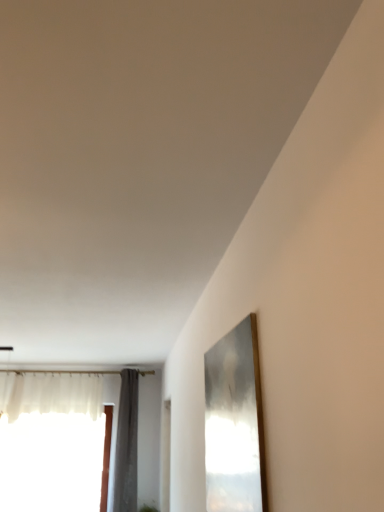
What is the approximate width of translucent fabric window at left?

translucent fabric window at left is 11.16 inches wide.

The image size is (384, 512). I want to click on translucent fabric window at left, so click(x=51, y=442).

The height and width of the screenshot is (512, 384). Describe the element at coordinates (51, 442) in the screenshot. I see `translucent fabric window at left` at that location.

Find the location of a particular element. gray fabric curtain at left is located at coordinates (126, 446).

Describe the element at coordinates (126, 446) in the screenshot. I see `gray fabric curtain at left` at that location.

At what (x,y) coordinates should I click in order to perform the action: click on translucent fabric window at left. Please return your answer as a coordinate pair (x, y). Looking at the image, I should click on (51, 442).

Is gray fabric curtain at left to the left of translucent fabric window at left from the viewer's perspective?

In fact, gray fabric curtain at left is to the right of translucent fabric window at left.

Which object is closer to the camera, gray fabric curtain at left or translucent fabric window at left?

Positioned in front is gray fabric curtain at left.

Which point is more distant from viewer, (135, 418) or (78, 386)?

Positioned behind is point (135, 418).

From the image's perspective, which is below, gray fabric curtain at left or translucent fabric window at left?

translucent fabric window at left appears lower in the image.

From a real-world perspective, is gray fabric curtain at left located higher than translucent fabric window at left?

Yes, from a real-world perspective, gray fabric curtain at left is over translucent fabric window at left

Which of these two, gray fabric curtain at left or translucent fabric window at left, is wider?

gray fabric curtain at left is wider.

Does gray fabric curtain at left have a lesser height compared to translucent fabric window at left?

No, gray fabric curtain at left is not shorter than translucent fabric window at left.

Does gray fabric curtain at left have a larger size compared to translucent fabric window at left?

Actually, gray fabric curtain at left might be smaller than translucent fabric window at left.

Is gray fabric curtain at left inside the boundaries of translucent fabric window at left, or outside?

gray fabric curtain at left lies outside translucent fabric window at left.

Is gray fabric curtain at left in contact with translucent fabric window at left?

No, gray fabric curtain at left is not next to translucent fabric window at left.

From the picture: Is gray fabric curtain at left facing towards translucent fabric window at left?

No, gray fabric curtain at left does not turn towards translucent fabric window at left.

How different are the orientations of gray fabric curtain at left and translucent fabric window at left in degrees?

gray fabric curtain at left and translucent fabric window at left are facing 0.000329 degrees away from each other.

The height and width of the screenshot is (512, 384). Find the location of `curtain lying above the translucent fabric window at left (from the image's perspective)`. curtain lying above the translucent fabric window at left (from the image's perspective) is located at coordinates (126, 446).

In the image, is translucent fabric window at left on the left side or the right side of gray fabric curtain at left?

From the image, it's evident that translucent fabric window at left is to the left of gray fabric curtain at left.

Considering the positions of objects translucent fabric window at left and gray fabric curtain at left in the image provided, who is behind, translucent fabric window at left or gray fabric curtain at left?

translucent fabric window at left is further away from the camera.

Is point (100, 453) in front of point (119, 421)?

Yes, point (100, 453) is in front of point (119, 421).

From the image's perspective, is translucent fabric window at left located beneath gray fabric curtain at left?

Indeed, from the image's perspective, translucent fabric window at left is shown beneath gray fabric curtain at left.

From a real-world perspective, does translucent fabric window at left stand above gray fabric curtain at left?

No, from a real-world perspective, translucent fabric window at left is not above gray fabric curtain at left.

Looking at this image, between translucent fabric window at left and gray fabric curtain at left, which one has smaller width?

With smaller width is translucent fabric window at left.

Which of these two, translucent fabric window at left or gray fabric curtain at left, stands taller?

gray fabric curtain at left is taller.

Considering the sizes of objects translucent fabric window at left and gray fabric curtain at left in the image provided, who is bigger, translucent fabric window at left or gray fabric curtain at left?

translucent fabric window at left is bigger.

Is translucent fabric window at left located outside gray fabric curtain at left?

Yes, translucent fabric window at left is outside of gray fabric curtain at left.

Is translucent fabric window at left next to gray fabric curtain at left?

No, translucent fabric window at left is not making contact with gray fabric curtain at left.

Could you tell me if translucent fabric window at left is facing gray fabric curtain at left?

No, translucent fabric window at left is not turned towards gray fabric curtain at left.

Can you tell me how much translucent fabric window at left and gray fabric curtain at left differ in facing direction?

There is a 0.000329-degree angle between the facing directions of translucent fabric window at left and gray fabric curtain at left.

How far apart are translucent fabric window at left and gray fabric curtain at left?

The distance of translucent fabric window at left from gray fabric curtain at left is 27.41 inches.

The width and height of the screenshot is (384, 512). I want to click on window below the gray fabric curtain at left (from a real-world perspective), so click(51, 442).

Locate an element on the screen. This screenshot has height=512, width=384. curtain above the translucent fabric window at left (from the image's perspective) is located at coordinates (126, 446).

Image resolution: width=384 pixels, height=512 pixels. What are the coordinates of `curtain on the right of the translucent fabric window at left` in the screenshot? It's located at [x=126, y=446].